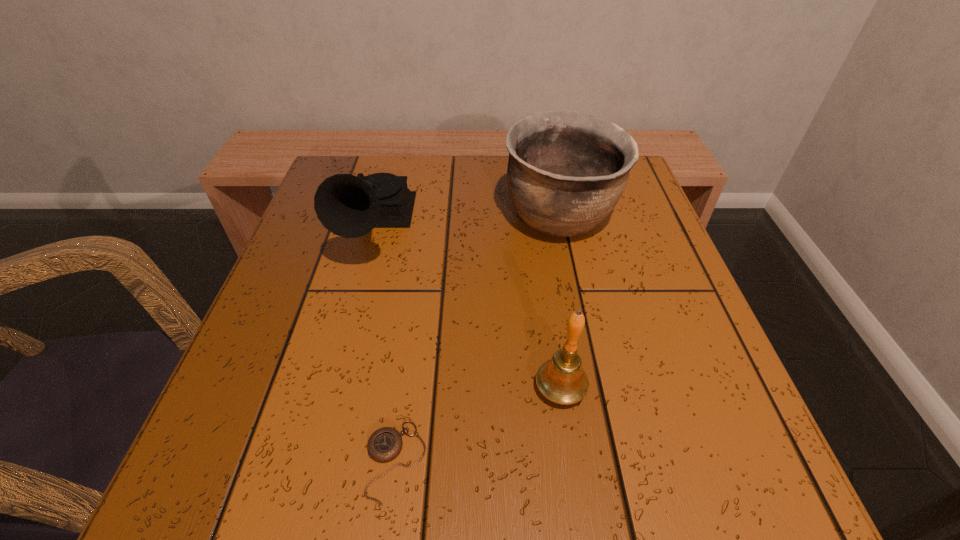
Where is `phonograph_record`? The height and width of the screenshot is (540, 960). phonograph_record is located at coordinates (349, 206).

Where is `pottery`? The image size is (960, 540). pottery is located at coordinates (567, 170).

Where is `the third farthest object`? The height and width of the screenshot is (540, 960). the third farthest object is located at coordinates (562, 380).

Find the location of a particular element. The height and width of the screenshot is (540, 960). pocket watch is located at coordinates (385, 444).

The image size is (960, 540). Find the location of `the shortest object`. the shortest object is located at coordinates (385, 444).

The width and height of the screenshot is (960, 540). Find the location of `vacant space situated 0.300m from the horn of the phonograph_record`. vacant space situated 0.300m from the horn of the phonograph_record is located at coordinates (319, 429).

The image size is (960, 540). I want to click on blank area located on the front of the pottery, so click(591, 372).

This screenshot has height=540, width=960. I want to click on free space located on the back of the bell, so click(536, 214).

At what (x,y) coordinates should I click in order to perform the action: click on free spot located on the right of the pocket watch. Please return your answer as a coordinate pair (x, y). Looking at the image, I should click on (546, 461).

At what (x,y) coordinates should I click in order to perform the action: click on phonograph_record that is at the far edge. Please return your answer as a coordinate pair (x, y). Looking at the image, I should click on (349, 206).